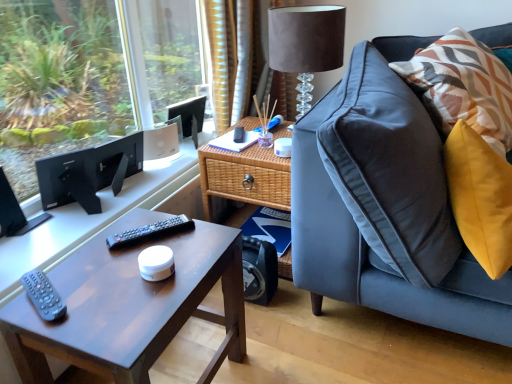
Identify the location of black plastic remote at lower left, which ranks as the 2th remote in right-to-left order. (42, 295).

Measure the distance between point (29, 292) and camera.

Point (29, 292) and camera are 35.83 inches apart.

Measure the distance between point (130, 313) and camera.

Point (130, 313) and camera are 34.29 inches apart from each other.

What do you see at coordinates (130, 305) in the screenshot? The image size is (512, 384). I see `matte brown coffee table at lower left` at bounding box center [130, 305].

Describe the element at coordinates (149, 232) in the screenshot. I see `black plastic remote at center, which appears as the 2th remote when viewed from the front` at that location.

Describe the element at coordinates (306, 44) in the screenshot. The image size is (512, 384). I see `suede lampshade at upper right` at that location.

What do you see at coordinates (464, 86) in the screenshot?
I see `patterned fabric pillow at right` at bounding box center [464, 86].

This screenshot has width=512, height=384. In order to click on woven wood side table at center in this screenshot , I will do `click(243, 177)`.

From a real-world perspective, is matte black computer desk at left physically located above or below matte brown coffee table at lower left?

In terms of real-world spatial position, matte black computer desk at left is above matte brown coffee table at lower left.

Who is smaller, matte black computer desk at left or matte brown coffee table at lower left?

With smaller size is matte black computer desk at left.

Between point (165, 190) and point (59, 266), which one is positioned behind?

Point (165, 190)

Which of these two, matte black computer desk at left or matte brown coffee table at lower left, stands taller?

matte brown coffee table at lower left.

Is woven wood side table at center to the left or to the right of black matte computer monitor at left in the image?

woven wood side table at center is to the right of black matte computer monitor at left.

Does woven wood side table at center have a greater height compared to black matte computer monitor at left?

Indeed, woven wood side table at center has a greater height compared to black matte computer monitor at left.

Is woven wood side table at center not within black matte computer monitor at left?

Yes, woven wood side table at center is outside of black matte computer monitor at left.

Does point (273, 178) appear closer or farther from the camera than point (132, 135)?

Point (273, 178) is positioned closer to the camera compared to point (132, 135).

Is suede lampshade at upper right to the left or to the right of patterned fabric pillow at right in the image?

In the image, suede lampshade at upper right appears on the left side of patterned fabric pillow at right.

Which of these two, suede lampshade at upper right or patterned fabric pillow at right, stands taller?

With more height is suede lampshade at upper right.

Find the location of `table lamp above the patterned fabric pillow at right (from the image's perspective)`. table lamp above the patterned fabric pillow at right (from the image's perspective) is located at coordinates (306, 44).

Is suede lampshade at upper right smaller than patterned fabric pillow at right?

Yes.

Relative to black matte computer monitor at left, is suede lampshade at upper right in front or behind?

Visually, suede lampshade at upper right is located behind black matte computer monitor at left.

Does suede lampshade at upper right turn towards black matte computer monitor at left?

No, suede lampshade at upper right is not aimed at black matte computer monitor at left.

From a real-world perspective, is suede lampshade at upper right located beneath black matte computer monitor at left?

No, from a real-world perspective, suede lampshade at upper right is not beneath black matte computer monitor at left.

Is point (302, 54) positioned in front of point (142, 147)?

Yes, point (302, 54) is closer to viewer.

How much distance is there between black plastic remote at center, which appears as the 1th remote when viewed from the right, and suede lampshade at upper right?

They are 73.40 centimeters apart.

Does black plastic remote at center, which appears as the 1th remote when viewed from the right, have a lesser height compared to suede lampshade at upper right?

Indeed, black plastic remote at center, which appears as the 1th remote when viewed from the right, has a lesser height compared to suede lampshade at upper right.

Could you tell me if black plastic remote at center, which appears as the 2th remote when viewed from the front, is facing suede lampshade at upper right?

No, black plastic remote at center, which appears as the 2th remote when viewed from the front, is not oriented towards suede lampshade at upper right.

Is point (156, 233) closer to viewer compared to point (322, 69)?

Yes, it is.

Is black plastic remote at lower left, the first remote from the left, positioned far away from patterned fabric pillow at right?

Yes, black plastic remote at lower left, the first remote from the left, and patterned fabric pillow at right are quite far apart.

Locate an element on the screen. This screenshot has width=512, height=384. pillow above the black plastic remote at lower left, which ranks as the 2th remote in right-to-left order (from the image's perspective) is located at coordinates (464, 86).

From the image's perspective, who appears lower, black plastic remote at lower left, acting as the second remote starting from the back, or patterned fabric pillow at right?

black plastic remote at lower left, acting as the second remote starting from the back.

From a real-world perspective, which is physically above, black plastic remote at lower left, which ranks as the 2th remote in right-to-left order, or patterned fabric pillow at right?

In real-world perspective, patterned fabric pillow at right is above.

Which object is wider, woven wood side table at center or suede lampshade at upper right?

woven wood side table at center is wider.

Is woven wood side table at center positioned behind suede lampshade at upper right?

Yes, woven wood side table at center is further from the camera.

Can you confirm if woven wood side table at center is positioned to the right of suede lampshade at upper right?

Incorrect, woven wood side table at center is not on the right side of suede lampshade at upper right.

I want to click on computer desk behind the matte brown coffee table at lower left, so click(101, 217).

The image size is (512, 384). I want to click on computer monitor in front of the woven wood side table at center, so click(x=89, y=173).

Considering their positions, is black plastic remote at lower left, the first remote from the left, positioned closer to black plastic remote at center, positioned as the 1th remote in top-to-bottom order, than patterned fabric pillow at right?

black plastic remote at lower left, the first remote from the left, lies closer to black plastic remote at center, positioned as the 1th remote in top-to-bottom order, than the other object.

Based on their spatial positions, is black plastic remote at center, positioned as the 1th remote in top-to-bottom order, or patterned fabric pillow at right closer to suede lampshade at upper right?

Based on the image, patterned fabric pillow at right appears to be nearer to suede lampshade at upper right.

Which object lies nearer to the anchor point woven wood side table at center, black matte computer monitor at left or black plastic remote at center, which appears as the 1th remote when viewed from the right?

black plastic remote at center, which appears as the 1th remote when viewed from the right.

Which object lies nearer to the anchor point black plastic remote at center, which appears as the 2th remote when viewed from the front, woven wood side table at center or patterned fabric pillow at right?

Based on the image, woven wood side table at center appears to be nearer to black plastic remote at center, which appears as the 2th remote when viewed from the front.

Based on their spatial positions, is suede lampshade at upper right or patterned fabric pillow at right closer to black matte computer monitor at left?

suede lampshade at upper right is positioned closer to the anchor black matte computer monitor at left.

Considering their positions, is patterned fabric pillow at right positioned closer to suede lampshade at upper right than matte brown coffee table at lower left?

patterned fabric pillow at right.

Estimate the real-world distances between objects in this image. Which object is closer to black plastic remote at lower left, which appears as the first remote when viewed from the front, black matte computer monitor at left or black plastic remote at center, which appears as the 1th remote when viewed from the right?

Among the two, black plastic remote at center, which appears as the 1th remote when viewed from the right, is located nearer to black plastic remote at lower left, which appears as the first remote when viewed from the front.

From the image, which object appears to be nearer to matte black computer desk at left, matte brown coffee table at lower left or black plastic remote at lower left, placed as the 2th remote when sorted from top to bottom?

matte brown coffee table at lower left is positioned closer to the anchor matte black computer desk at left.

Find the location of a particular element. The width and height of the screenshot is (512, 384). table located between black plastic remote at lower left, the first remote from the left, and patterned fabric pillow at right in the left-right direction is located at coordinates (243, 177).

At what (x,y) coordinates should I click in order to perform the action: click on computer monitor located between matte brown coffee table at lower left and woven wood side table at center in the depth direction. Please return your answer as a coordinate pair (x, y). Looking at the image, I should click on (89, 173).

Locate an element on the screen. Image resolution: width=512 pixels, height=384 pixels. remote between suede lampshade at upper right and black plastic remote at lower left, which appears as the first remote when viewed from the front, vertically is located at coordinates (149, 232).

This screenshot has height=384, width=512. What are the coordinates of `remote located between black plastic remote at lower left, placed as the 2th remote when sorted from top to bottom, and black matte computer monitor at left in the depth direction` in the screenshot? It's located at (149, 232).